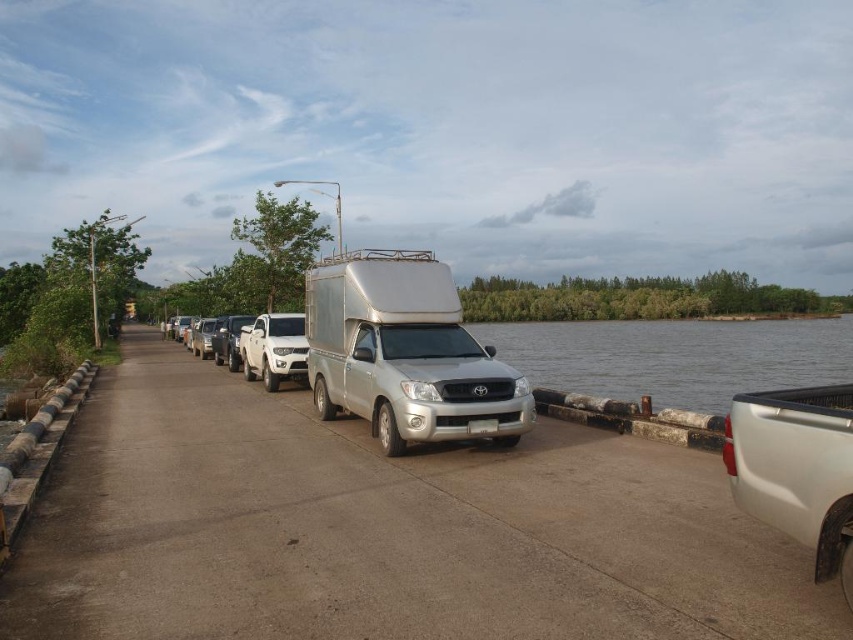
Between silver metallic van at center and satin silver sedan at center, which one is positioned lower?

Positioned lower is satin silver sedan at center.

Is silver metallic van at center below satin silver sedan at center?

Actually, silver metallic van at center is above satin silver sedan at center.

This screenshot has height=640, width=853. What do you see at coordinates (405, 353) in the screenshot? I see `silver metallic van at center` at bounding box center [405, 353].

Identify the location of silver metallic van at center. (405, 353).

Which of these two, gray water at right or white matte truck at center, stands taller?

Standing taller between the two is gray water at right.

Can you confirm if gray water at right is positioned below white matte truck at center?

Actually, gray water at right is above white matte truck at center.

Locate an element on the screen. gray water at right is located at coordinates (675, 356).

Identify the location of white matte truck at center. (274, 348).

The image size is (853, 640). Identify the location of white matte truck at center. (274, 348).

The height and width of the screenshot is (640, 853). In order to click on white matte truck at center in this screenshot , I will do `click(274, 348)`.